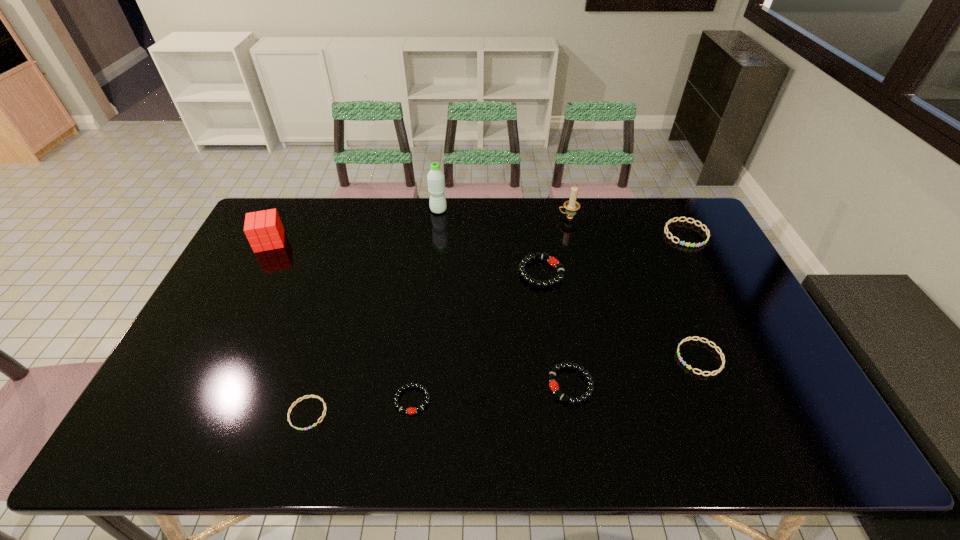
This screenshot has width=960, height=540. Find the location of `free space that satisfies the following two spatial constraints: 1. on the handle side of the candle_holder; 2. on the front side of the cube`. free space that satisfies the following two spatial constraints: 1. on the handle side of the candle_holder; 2. on the front side of the cube is located at coordinates (573, 241).

I want to click on vacant space that satisfies the following two spatial constraints: 1. on the surface of the biggest blue bracelet showing star-shaped elements; 2. on the surface of the second nearest blue bracelet showing star-shaped elements, so click(x=750, y=357).

Locate an element on the screen. This screenshot has width=960, height=540. free space in the image that satisfies the following two spatial constraints: 1. on the surface of the farthest bracelet showing star-shaped elements; 2. on the surface of the second nearest blue bracelet showing star-shaped elements is located at coordinates (750, 357).